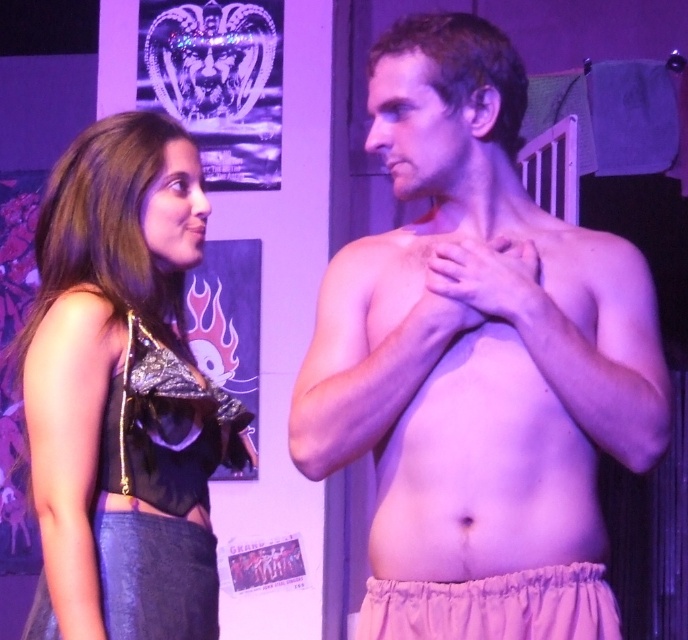
You are a photographer setting up a shoot in this room. You need to place a small prop between the pink fabric shorts at center and the elastic white underwear at lower center. Based on their positions, where should you place the prop so it is closer to the camera?

The prop should be placed closer to the pink fabric shorts at center because it is closer to the viewer than the elastic white underwear at lower center.

You are a photographer setting up a camera at eye level with the two people in the scene. You want to capture both the pink fabric shorts at center and the smooth skin chest at center in the same shot without moving the camera. Which object will appear larger in the final photo?

The pink fabric shorts at center will appear larger in the photo because it is much taller than the smooth skin chest at center, so when captured at eye level, the taller object will take up more space in the frame.